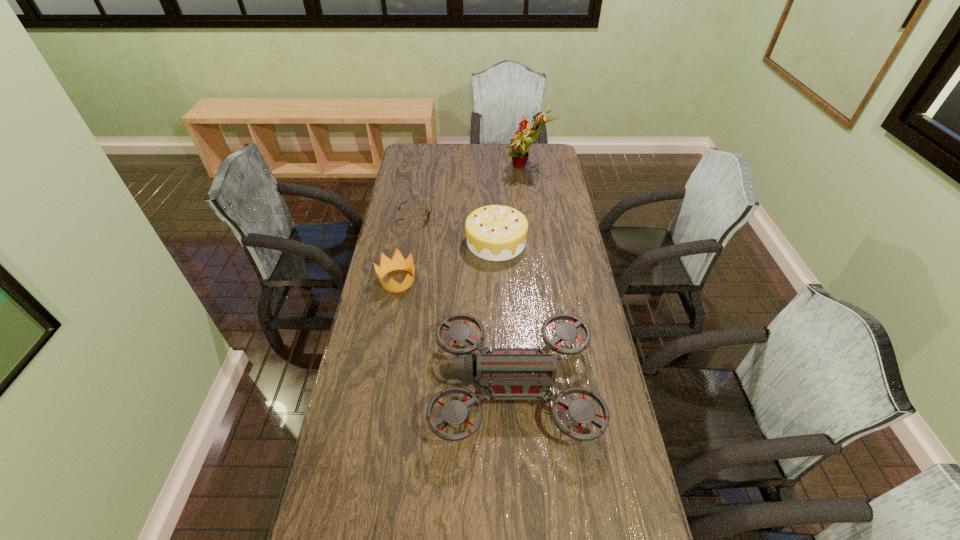
Where is `vacant space located on the back of the birthday cake`? This screenshot has height=540, width=960. vacant space located on the back of the birthday cake is located at coordinates [x=494, y=209].

Find the location of `free point located on the front-facing side of the drone`. free point located on the front-facing side of the drone is located at coordinates coord(392,386).

Find the location of a particular element. This screenshot has height=540, width=960. vacant space located on the front-facing side of the drone is located at coordinates (348, 386).

Locate an element on the screen. vacant space located 0.160m on the front-facing side of the drone is located at coordinates (378, 386).

Where is `vacant space located 0.060m on the right of the fourth tallest object`? This screenshot has height=540, width=960. vacant space located 0.060m on the right of the fourth tallest object is located at coordinates (435, 281).

Where is `vacant area located 0.150m on the front-facing side of the sunglasses`? vacant area located 0.150m on the front-facing side of the sunglasses is located at coordinates (466, 216).

The height and width of the screenshot is (540, 960). I want to click on object that is positioned at the far edge, so click(519, 144).

Find the location of `crown that is at the left edge`. crown that is at the left edge is located at coordinates (398, 262).

You are a GUI agent. You are given a task and a screenshot of the screen. Output one action in this format:
    pyautogui.click(x=<x>, y=<y>)
    Task: Click on the sunglasses situated at the left edge
    
    Given the screenshot: What is the action you would take?
    pyautogui.click(x=429, y=210)

Find the location of a particular element. The height and width of the screenshot is (540, 960). bouquet positioned at the right edge is located at coordinates (519, 144).